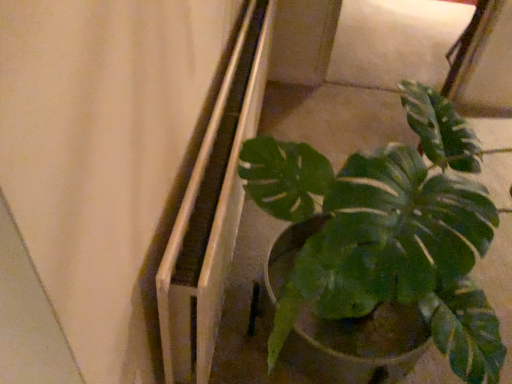
Find the location of a particular element. green matte plant at center is located at coordinates (409, 222).

Image resolution: width=512 pixels, height=384 pixels. Describe the element at coordinates (409, 222) in the screenshot. I see `green matte plant at center` at that location.

Locate an element on the screen. The height and width of the screenshot is (384, 512). green matte plant at center is located at coordinates (409, 222).